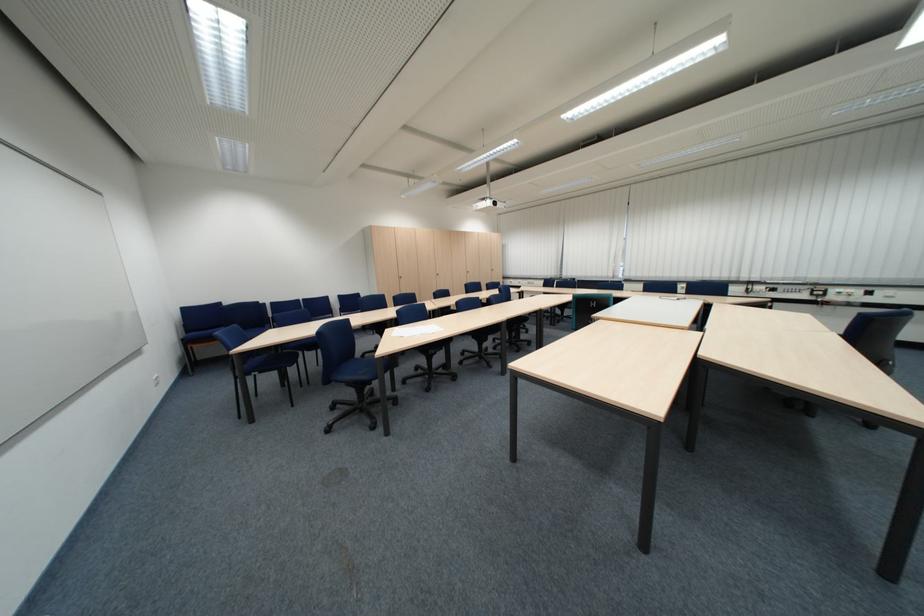
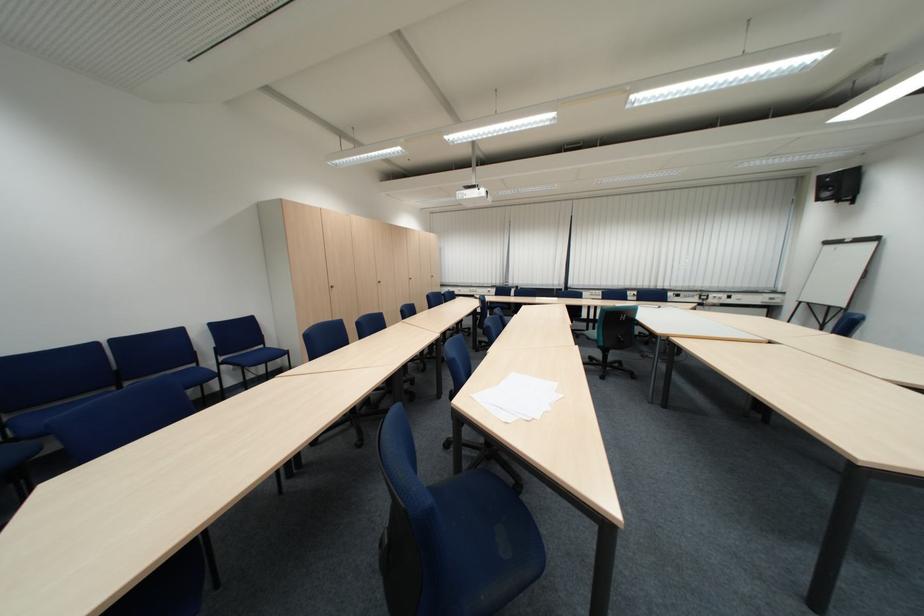
In the second image, find the point that corresponds to point (618, 276) in the first image.

(564, 284)